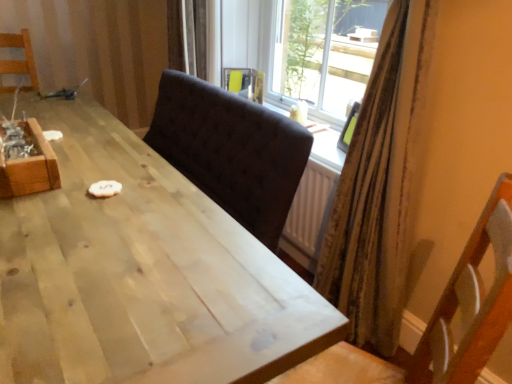
Question: From a real-world perspective, is wooden crate at left located higher than light wood table at center?

Choices:
 (A) yes
 (B) no

Answer: (A)

Question: Can you confirm if wooden crate at left is bigger than light wood table at center?

Choices:
 (A) yes
 (B) no

Answer: (B)

Question: Is wooden crate at left in front of light wood table at center?

Choices:
 (A) no
 (B) yes

Answer: (A)

Question: Does wooden crate at left have a lesser width compared to light wood table at center?

Choices:
 (A) yes
 (B) no

Answer: (A)

Question: Is wooden crate at left with light wood table at center?

Choices:
 (A) no
 (B) yes

Answer: (A)

Question: From the image's perspective, relative to wooden crate at left, is light wood table at center above or below?

Choices:
 (A) below
 (B) above

Answer: (A)

Question: From a real-world perspective, is light wood table at center positioned above or below wooden crate at left?

Choices:
 (A) above
 (B) below

Answer: (B)

Question: Choose the correct answer: Is light wood table at center inside wooden crate at left or outside it?

Choices:
 (A) outside
 (B) inside

Answer: (A)

Question: Considering the positions of light wood table at center and wooden crate at left in the image, is light wood table at center bigger or smaller than wooden crate at left?

Choices:
 (A) small
 (B) big

Answer: (B)

Question: Is point (250, 286) positioned closer to the camera than point (24, 86)?

Choices:
 (A) closer
 (B) farther

Answer: (A)

Question: Is light wood table at center spatially inside wooden chair at left, positioned as the 1th chair in left-to-right order, or outside of it?

Choices:
 (A) outside
 (B) inside

Answer: (A)

Question: In the image, is light wood table at center positioned in front of or behind wooden chair at left, marked as the 2th chair in a front-to-back arrangement?

Choices:
 (A) front
 (B) behind

Answer: (A)

Question: Is light wood table at center bigger or smaller than wooden chair at left, which ranks as the 1th chair in top-to-bottom order?

Choices:
 (A) small
 (B) big

Answer: (B)

Question: Is wooden chair at left, which ranks as the 1th chair in top-to-bottom order, in front of or behind dark fabric chair at center, placed as the 2th chair when sorted from top to bottom, in the image?

Choices:
 (A) behind
 (B) front

Answer: (A)

Question: From their relative heights in the image, would you say wooden chair at left, the second chair from the bottom, is taller or shorter than dark fabric chair at center, arranged as the 1th chair when viewed from the right?

Choices:
 (A) short
 (B) tall

Answer: (A)